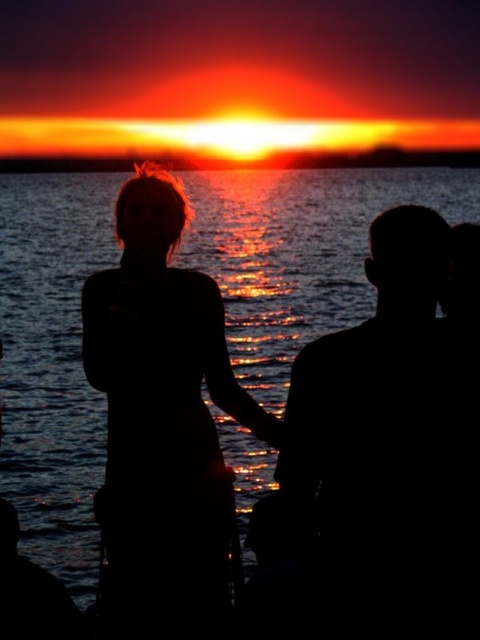
Question: Does glistening water at center have a larger size compared to silhouette hair at center?

Choices:
 (A) yes
 (B) no

Answer: (A)

Question: Does glistening water at center appear under sunset sky at center?

Choices:
 (A) yes
 (B) no

Answer: (A)

Question: Estimate the real-world distances between objects in this image. Which object is closer to the glistening water at center?

Choices:
 (A) sunset sky at center
 (B) silhouette hair at center

Answer: (B)

Question: Does glistening water at center appear over sunset sky at center?

Choices:
 (A) yes
 (B) no

Answer: (B)

Question: Which of the following is the farthest from the observer?

Choices:
 (A) sunset sky at center
 (B) silhouette hair at center

Answer: (A)

Question: Which of the following is the farthest from the observer?

Choices:
 (A) silhouette hair at center
 (B) sunset sky at center
 (C) glistening water at center

Answer: (B)